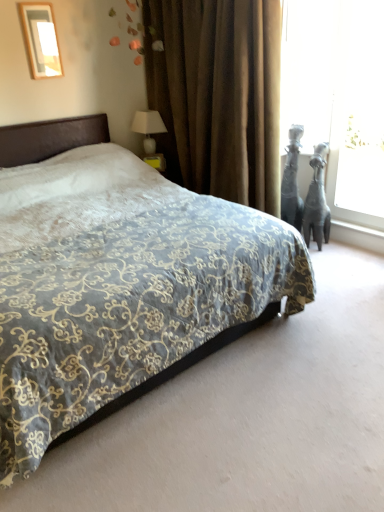
At what (x,y) coordinates should I click in order to perform the action: click on vacant area that is situated to the right of matte black giraffe at right. Please return your answer as a coordinate pair (x, y). The height and width of the screenshot is (512, 384). Looking at the image, I should click on (341, 249).